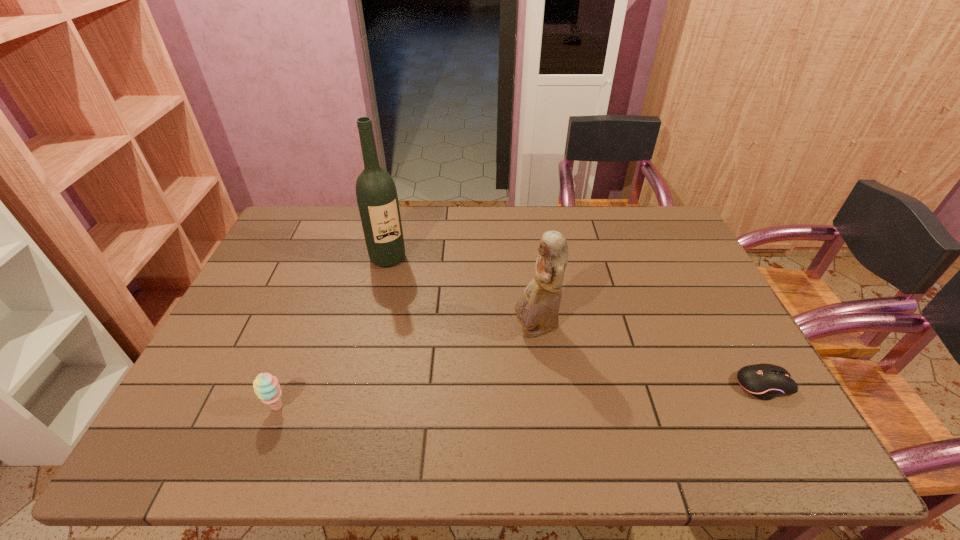
Identify the location of vacant area that lies between the second object from right to left and the shortest object. (650, 357).

The width and height of the screenshot is (960, 540). What are the coordinates of `free point between the leftmost object and the rightmost object` in the screenshot? It's located at (520, 396).

The height and width of the screenshot is (540, 960). I want to click on free space between the computer mouse and the second tallest object, so click(650, 357).

At what (x,y) coordinates should I click in order to perform the action: click on empty location between the figurine and the third tallest object. Please return your answer as a coordinate pair (x, y). This screenshot has width=960, height=540. Looking at the image, I should click on (407, 368).

Where is `empty space between the figurine and the computer mouse`? The height and width of the screenshot is (540, 960). empty space between the figurine and the computer mouse is located at coordinates (650, 357).

I want to click on vacant space that's between the rightmost object and the tallest object, so click(x=576, y=322).

Select which object appears as the third closest to the leftmost object. Please provide its 2D coordinates. Your answer should be formatted as a tuple, i.e. [(x, y)], where the tuple contains the x and y coordinates of a point satisfying the conditions above.

[(764, 381)]

Point out which object is positioned as the second nearest to the sherbert. Please provide its 2D coordinates. Your answer should be formatted as a tuple, i.e. [(x, y)], where the tuple contains the x and y coordinates of a point satisfying the conditions above.

[(537, 308)]

Where is `free location that satisfies the following two spatial constraints: 1. on the back side of the second shortest object; 2. on the left side of the second object from right to left`? This screenshot has width=960, height=540. free location that satisfies the following two spatial constraints: 1. on the back side of the second shortest object; 2. on the left side of the second object from right to left is located at coordinates (307, 329).